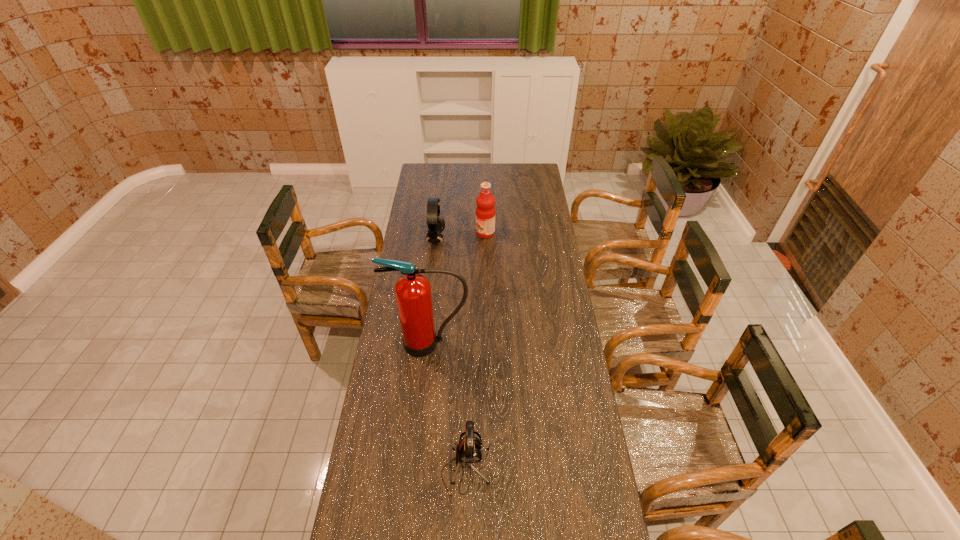
I want to click on vacant point located between the nearest object and the third farthest object, so click(x=447, y=407).

What are the coordinates of `vacant space in between the fruit juice and the nearer earphone` in the screenshot? It's located at (475, 352).

Identify the location of vacant space in between the nearest object and the fruit juice. Image resolution: width=960 pixels, height=540 pixels. (475, 352).

The image size is (960, 540). In order to click on free area in between the right earphone and the left earphone in this screenshot , I will do `click(451, 355)`.

I want to click on vacant area that lies between the left earphone and the third shortest object, so click(461, 237).

The width and height of the screenshot is (960, 540). In order to click on empty space between the nearest object and the fruit juice in this screenshot , I will do `click(475, 352)`.

At what (x,y) coordinates should I click in order to perform the action: click on empty location between the fire extinguisher and the left earphone. Please return your answer as a coordinate pair (x, y). This screenshot has height=540, width=960. Looking at the image, I should click on [x=433, y=292].

Find the location of a particular element. This screenshot has width=960, height=540. vacant space that's between the nearer earphone and the fire extinguisher is located at coordinates (447, 407).

Identify which object is the third nearest to the farther earphone. Please provide its 2D coordinates. Your answer should be formatted as a tuple, i.e. [(x, y)], where the tuple contains the x and y coordinates of a point satisfying the conditions above.

[(468, 451)]

Identify the location of object that ranks as the closest to the nearest object. The height and width of the screenshot is (540, 960). (413, 294).